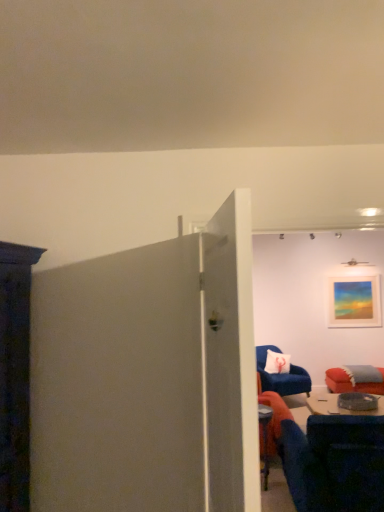
Measure the distance between point (343, 289) and camera.

The depth of point (343, 289) is 5.66 meters.

What do you see at coordinates (335, 463) in the screenshot?
I see `blue fabric chair at lower right, the first chair viewed from the front` at bounding box center [335, 463].

The width and height of the screenshot is (384, 512). What do you see at coordinates (282, 376) in the screenshot? I see `velvet blue chair at right, arranged as the 1th chair when viewed from the back` at bounding box center [282, 376].

This screenshot has height=512, width=384. In order to click on white glossy door at center in this screenshot , I will do `click(231, 359)`.

At what (x,y) coordinates should I click in order to perform the action: click on door located above the velvet blue chair at right, arranged as the 1th chair when viewed from the back (from the image's perspective). Please return your answer as a coordinate pair (x, y). This screenshot has width=384, height=512. Looking at the image, I should click on (231, 359).

Does velvet blue chair at right, which is the second chair in front-to-back order, have a greater width compared to white glossy door at center?

Correct, the width of velvet blue chair at right, which is the second chair in front-to-back order, exceeds that of white glossy door at center.

Considering their positions, is velvet blue chair at right, which is the second chair in front-to-back order, located in front of or behind white glossy door at center?

Visually, velvet blue chair at right, which is the second chair in front-to-back order, is located behind white glossy door at center.

Is velvet blue chair at right, which is the second chair in front-to-back order, next to white glossy door at center?

No.

Considering the sizes of objects matte acrylic painting at upper right and velvet blue chair at right, arranged as the 1th chair when viewed from the back, in the image provided, who is thinner, matte acrylic painting at upper right or velvet blue chair at right, arranged as the 1th chair when viewed from the back,?

With smaller width is matte acrylic painting at upper right.

From a real-world perspective, who is located higher, matte acrylic painting at upper right or velvet blue chair at right, arranged as the 1th chair when viewed from the back?

matte acrylic painting at upper right, from a real-world perspective.

Can you confirm if matte acrylic painting at upper right is taller than velvet blue chair at right, arranged as the 1th chair when viewed from the back?

Incorrect, the height of matte acrylic painting at upper right is not larger of that of velvet blue chair at right, arranged as the 1th chair when viewed from the back.

Which of these two, matte acrylic painting at upper right or velvet blue chair at right, which is the second chair in front-to-back order, is smaller?

With smaller size is matte acrylic painting at upper right.

Is white glossy door at center facing away from velvet blue chair at right, which is the second chair in front-to-back order?

white glossy door at center is not turned away from velvet blue chair at right, which is the second chair in front-to-back order.

Measure the distance from white glossy door at center to velvet blue chair at right, which is the second chair in front-to-back order.

11.47 feet.

Which is correct: white glossy door at center is inside velvet blue chair at right, arranged as the 1th chair when viewed from the back, or outside of it?

white glossy door at center is not inside velvet blue chair at right, arranged as the 1th chair when viewed from the back, it's outside.

What's the angular difference between white glossy door at center and velvet blue chair at right, arranged as the 1th chair when viewed from the back,'s facing directions?

There is a 72-degree angle between the facing directions of white glossy door at center and velvet blue chair at right, arranged as the 1th chair when viewed from the back.

Between velvet blue chair at right, which is the second chair in front-to-back order, and matte acrylic painting at upper right, which one has larger size?

Bigger between the two is velvet blue chair at right, which is the second chair in front-to-back order.

From a real-world perspective, which object stands above the other?

In real-world perspective, matte acrylic painting at upper right is above.

Is velvet blue chair at right, arranged as the 1th chair when viewed from the back, facing away from matte acrylic painting at upper right?

No, matte acrylic painting at upper right is not at the back of velvet blue chair at right, arranged as the 1th chair when viewed from the back.

Is matte acrylic painting at upper right a part of velvet blue chair at right, which is the second chair in front-to-back order?

No, matte acrylic painting at upper right is located outside of velvet blue chair at right, which is the second chair in front-to-back order.

Between blue fabric chair at lower right, the first chair viewed from the front, and velvet blue chair at right, arranged as the 1th chair when viewed from the back, which one has more height?

With more height is blue fabric chair at lower right, the first chair viewed from the front.

From a real-world perspective, is blue fabric chair at lower right, the first chair viewed from the front, positioned under velvet blue chair at right, which is the second chair in front-to-back order, based on gravity?

Incorrect, from a real-world perspective, blue fabric chair at lower right, the first chair viewed from the front, is higher than velvet blue chair at right, which is the second chair in front-to-back order.

Visually, is blue fabric chair at lower right, which appears as the 2th chair when viewed from the back, positioned to the left or to the right of velvet blue chair at right, arranged as the 1th chair when viewed from the back?

blue fabric chair at lower right, which appears as the 2th chair when viewed from the back, is positioned on velvet blue chair at right, arranged as the 1th chair when viewed from the back,'s left side.

Between blue fabric chair at lower right, the first chair viewed from the front, and white glossy door at center, which one appears on the right side from the viewer's perspective?

blue fabric chair at lower right, the first chair viewed from the front.

Does point (326, 436) lie in front of point (211, 436)?

No, (326, 436) is behind (211, 436).

From a real-world perspective, count 1st chairs downward from the white glossy door at center and point to it. Please provide its 2D coordinates.

[(335, 463)]

From a real-world perspective, between blue fabric chair at lower right, the first chair viewed from the front, and white glossy door at center, who is vertically higher?

white glossy door at center is physically above.

From a real-world perspective, who is located lower, white glossy door at center or matte acrylic painting at upper right?

In real-world perspective, matte acrylic painting at upper right is lower.

The height and width of the screenshot is (512, 384). I want to click on picture frame behind the white glossy door at center, so click(x=353, y=301).

From the image's perspective, is white glossy door at center located beneath matte acrylic painting at upper right?

No.

Is white glossy door at center oriented away from matte acrylic painting at upper right?

No, matte acrylic painting at upper right is not at the back of white glossy door at center.

Where is `door above the velvet blue chair at right, which is the second chair in front-to-back order (from a real-world perspective)`? This screenshot has width=384, height=512. door above the velvet blue chair at right, which is the second chair in front-to-back order (from a real-world perspective) is located at coordinates (231, 359).

In the image, there is a velvet blue chair at right, which is the second chair in front-to-back order. Find the location of `picture frame above it (from the image's perspective)`. picture frame above it (from the image's perspective) is located at coordinates (353, 301).

When comparing their distances from velvet blue chair at right, arranged as the 1th chair when viewed from the back, does matte acrylic painting at upper right or white glossy door at center seem further?

Based on the image, white glossy door at center appears to be further to velvet blue chair at right, arranged as the 1th chair when viewed from the back.

Which object lies nearer to the anchor point white glossy door at center, velvet blue chair at right, arranged as the 1th chair when viewed from the back, or matte acrylic painting at upper right?

Based on the image, velvet blue chair at right, arranged as the 1th chair when viewed from the back, appears to be nearer to white glossy door at center.

From the image, which object appears to be farther from matte acrylic painting at upper right, white glossy door at center or velvet blue chair at right, arranged as the 1th chair when viewed from the back?

white glossy door at center is further to matte acrylic painting at upper right.

Which object lies further to the anchor point white glossy door at center, blue fabric chair at lower right, the first chair viewed from the front, or velvet blue chair at right, which is the second chair in front-to-back order?

velvet blue chair at right, which is the second chair in front-to-back order.

From the image, which object appears to be nearer to matte acrylic painting at upper right, velvet blue chair at right, which is the second chair in front-to-back order, or white glossy door at center?

velvet blue chair at right, which is the second chair in front-to-back order, is positioned closer to the anchor matte acrylic painting at upper right.

Which object lies further to the anchor point white glossy door at center, velvet blue chair at right, which is the second chair in front-to-back order, or blue fabric chair at lower right, which appears as the 2th chair when viewed from the back?

velvet blue chair at right, which is the second chair in front-to-back order, lies further to white glossy door at center than the other object.

Estimate the real-world distances between objects in this image. Which object is further from blue fabric chair at lower right, which appears as the 2th chair when viewed from the back, white glossy door at center or velvet blue chair at right, arranged as the 1th chair when viewed from the back?

velvet blue chair at right, arranged as the 1th chair when viewed from the back, lies further to blue fabric chair at lower right, which appears as the 2th chair when viewed from the back, than the other object.

Estimate the real-world distances between objects in this image. Which object is further from matte acrylic painting at upper right, blue fabric chair at lower right, which appears as the 2th chair when viewed from the back, or white glossy door at center?

The object further to matte acrylic painting at upper right is white glossy door at center.

Where is `chair positioned between blue fabric chair at lower right, the first chair viewed from the front, and matte acrylic painting at upper right from near to far`? chair positioned between blue fabric chair at lower right, the first chair viewed from the front, and matte acrylic painting at upper right from near to far is located at coordinates (282, 376).

I want to click on chair between white glossy door at center and velvet blue chair at right, which is the second chair in front-to-back order, from front to back, so click(x=335, y=463).